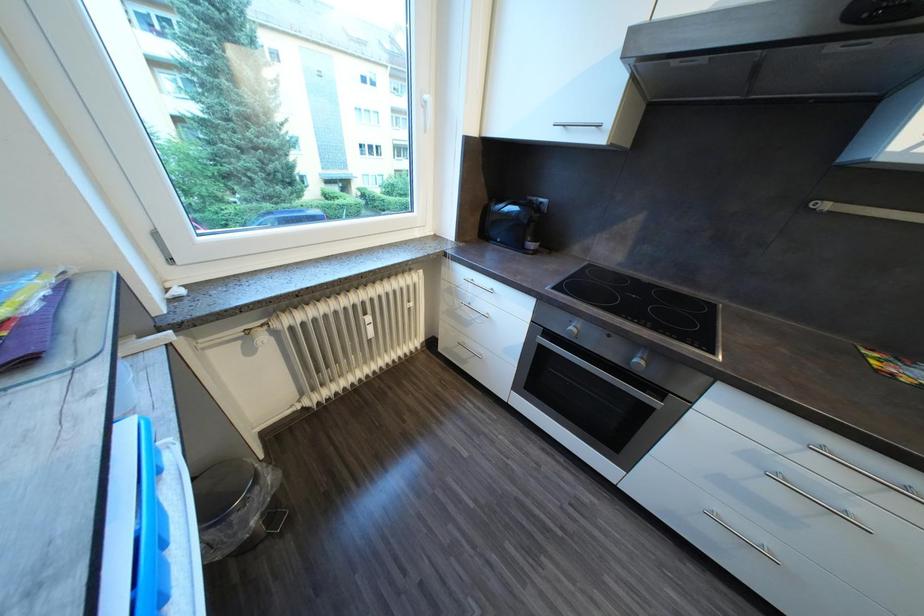
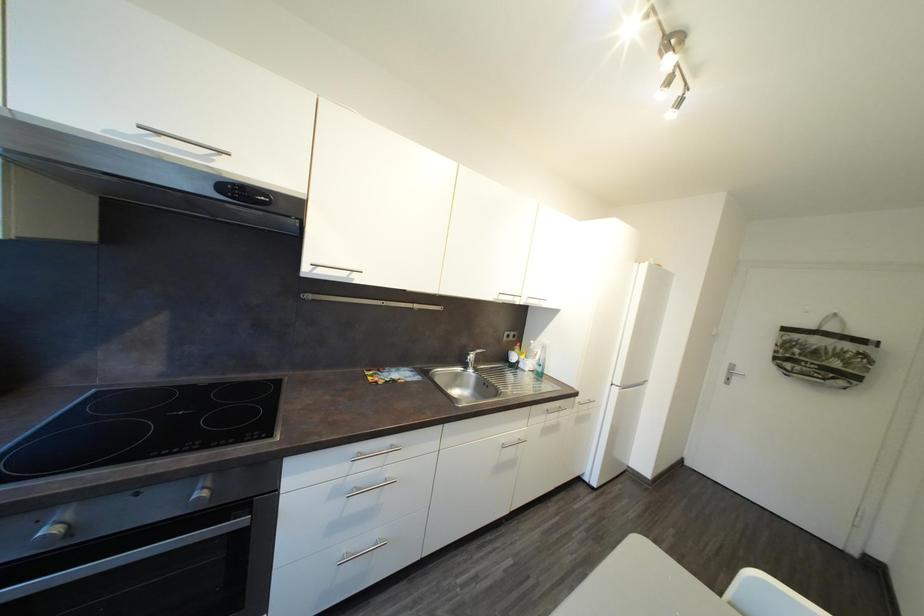
Question: The camera is either moving clockwise (left) or counter-clockwise (right) around the object. The first image is from the beginning of the video and the second image is from the end. Is the camera moving left or right when shooting the video?

Choices:
 (A) Left
 (B) Right

Answer: (A)